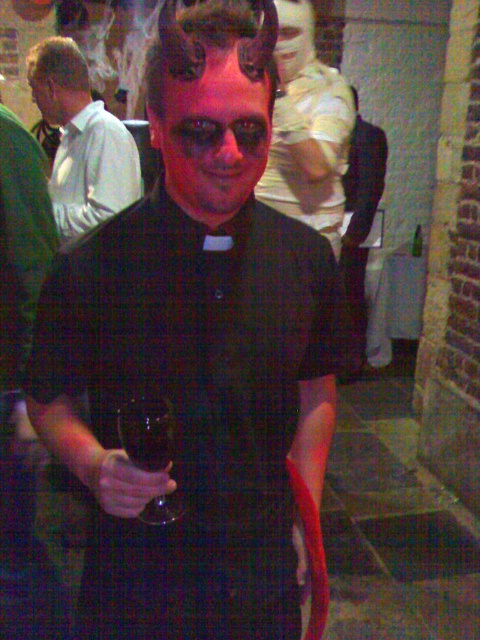
You are a photographer at an event and notice two objects labeled as black matte shirt at center and matte black shirt at center in the scene. Which one is positioned lower in the image?

The black matte shirt at center is located below the matte black shirt at center, so it is positioned lower in the image.

What are the coordinates of the black matte shirt at center?

The black matte shirt at center is located at coordinates point (x=193, y=406).

In the scene shown: You are at an event and want to take a photo of the black matte shirt at center and the matte white shirt at left. Which one would appear larger in your photo?

The black matte shirt at center would appear larger in the photo because it is closer to the viewer than the matte white shirt at left.